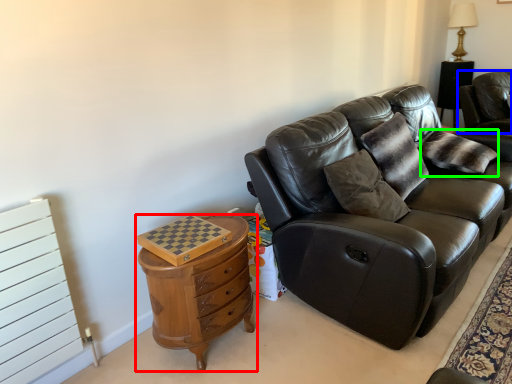
Question: Estimate the real-world distances between objects in this image. Which object is farther from chest of drawers (highlighted by a red box), chair (highlighted by a blue box) or pillow (highlighted by a green box)?

Choices:
 (A) chair
 (B) pillow

Answer: (A)